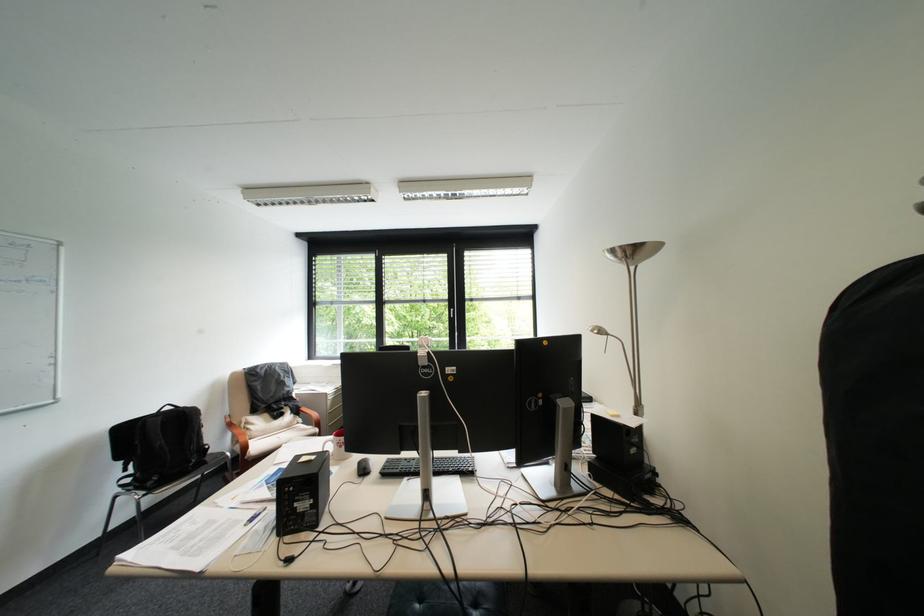
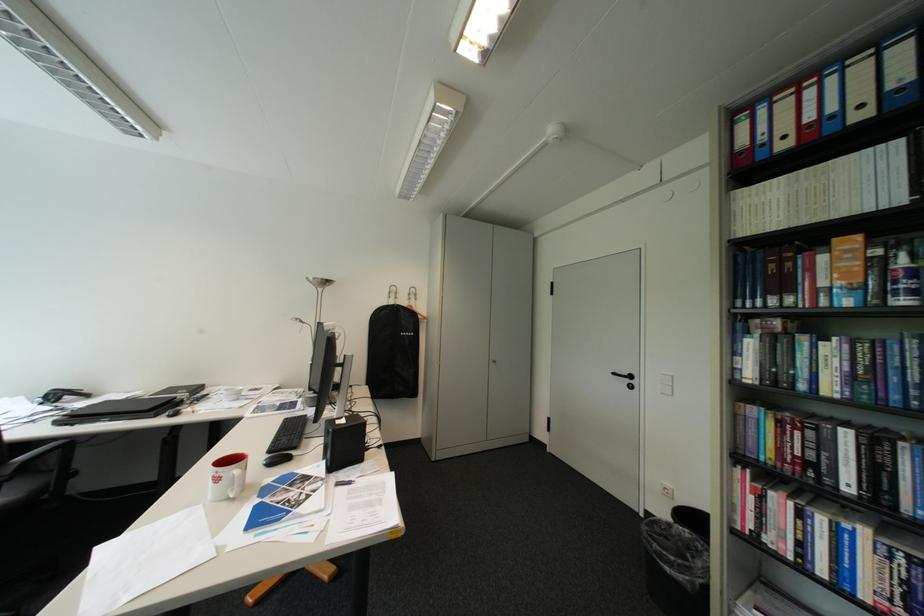
Question: I am providing you with two images of the same scene from different viewpoints. Please identify which objects are invisible in image2.

Choices:
 (A) steel trashcan
 (B) black keyboard
 (C) black door handle
 (D) blue and white can

Answer: (B)